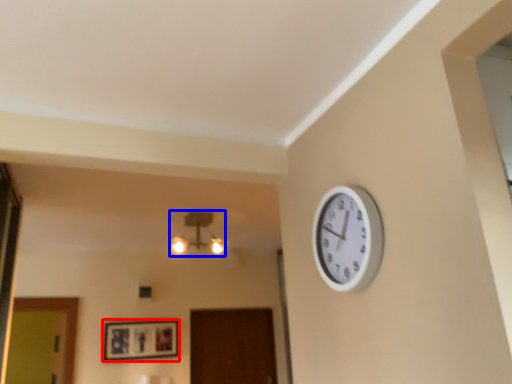
Question: Which object is further to the camera taking this photo, picture frame (highlighted by a red box) or lamp (highlighted by a blue box)?

Choices:
 (A) picture frame
 (B) lamp

Answer: (A)